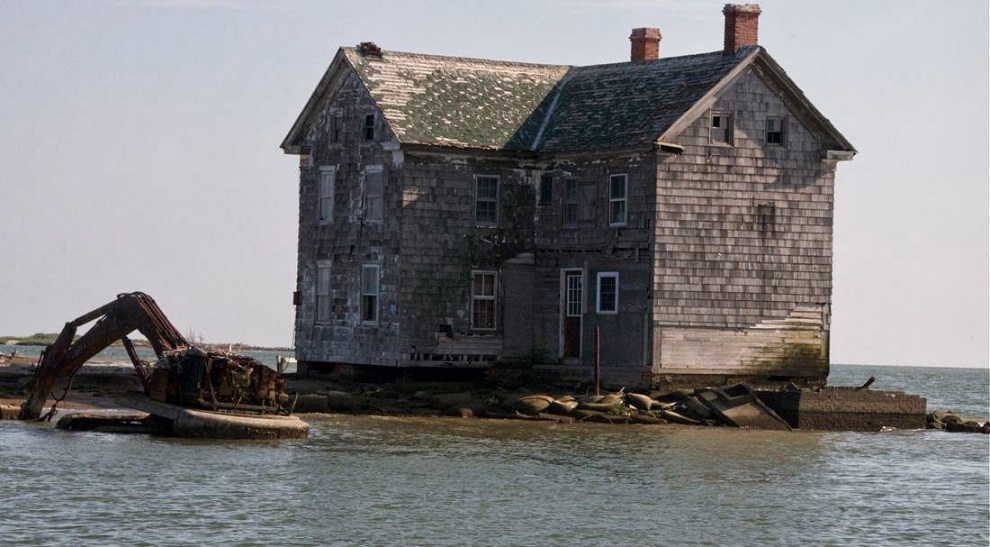
You are a GUI agent. You are given a task and a screenshot of the screen. Output one action in this format:
    pyautogui.click(x=<x>, y=<y>)
    Task: Click on the door
    
    Given the screenshot: What is the action you would take?
    pyautogui.click(x=572, y=331)